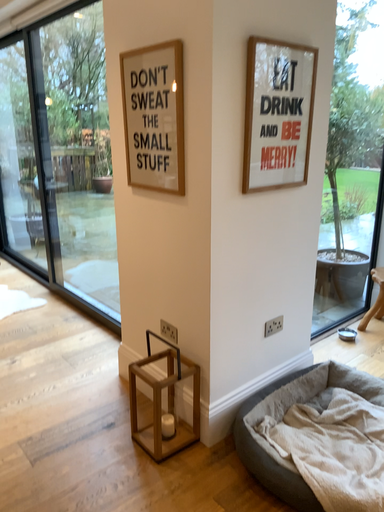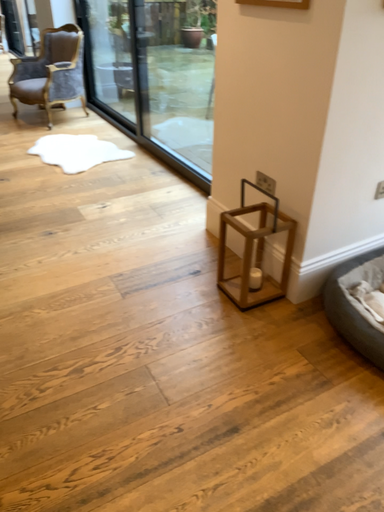
Question: How did the camera likely rotate when shooting the video?

Choices:
 (A) rotated right
 (B) rotated left

Answer: (B)